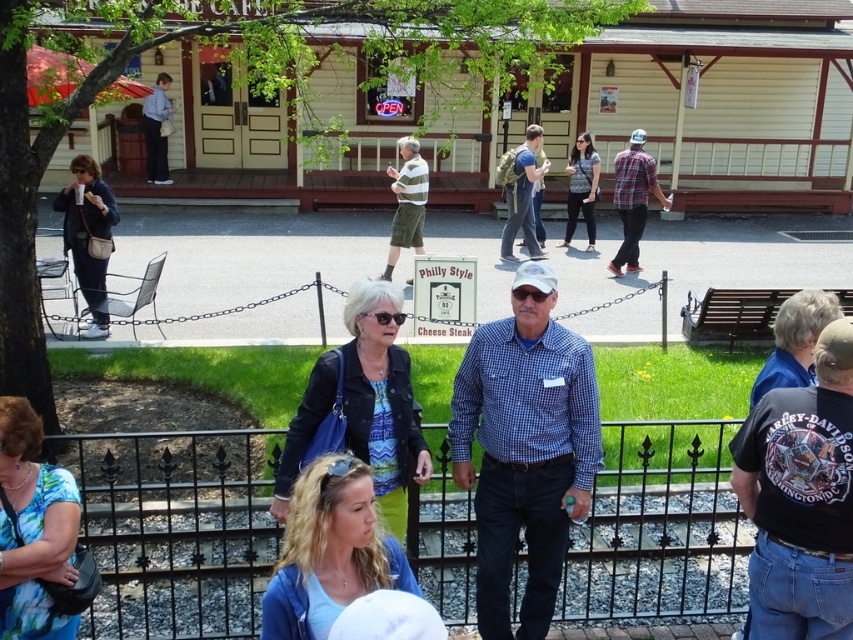
Image resolution: width=853 pixels, height=640 pixels. What do you see at coordinates (177, 529) in the screenshot?
I see `black wrought iron fence at center` at bounding box center [177, 529].

Does point (660, 540) lie behind point (811, 380)?

Yes, point (660, 540) is behind point (811, 380).

Is point (141, 625) closer to camera compared to point (799, 378)?

No, (141, 625) is behind (799, 378).

You are a GUI agent. You are given a task and a screenshot of the screen. Output one action in this format:
    pyautogui.click(x=<x>, y=<y>)
    Task: Click on the black wrought iron fence at center
    The image size is (853, 640).
    Given the screenshot: What is the action you would take?
    pyautogui.click(x=177, y=529)

Image resolution: width=853 pixels, height=640 pixels. I want to click on blonde hair at center, so (329, 552).

Is blonde hair at center shorter than floral blouse at center?

Yes.

Between point (302, 547) and point (32, 529), which one is positioned in front?

Point (302, 547) is more forward.

Find the location of a particular element. This screenshot has height=640, width=853. blonde hair at center is located at coordinates (329, 552).

Which is below, dark blue jacket at left or matte blue shirt at center?

dark blue jacket at left is below.

Looking at this image, is dark blue jacket at left wider than matte blue shirt at center?

Correct, the width of dark blue jacket at left exceeds that of matte blue shirt at center.

Is point (80, 209) farther from viewer compared to point (527, 132)?

No, (80, 209) is closer to viewer.

Find the location of a particular element. The image size is (853, 640). dark blue jacket at left is located at coordinates (88, 234).